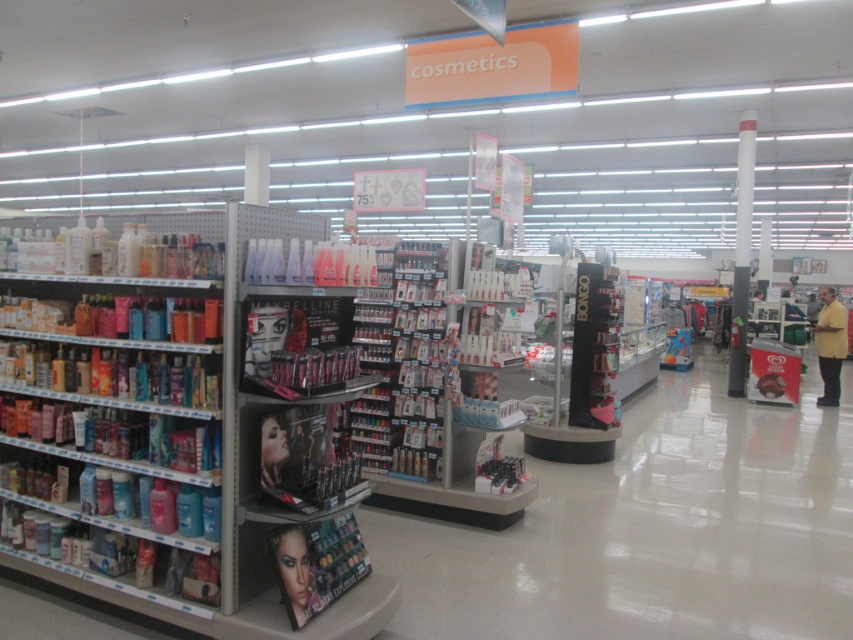
Question: Among these objects, which one is nearest to the camera?

Choices:
 (A) yellow matte shirt at right
 (B) white glossy pillar at center

Answer: (A)

Question: Which point appears closest to the camera in this image?

Choices:
 (A) (819, 336)
 (B) (751, 129)

Answer: (A)

Question: Where is white glossy pillar at center located in relation to yellow matte shirt at right in the image?

Choices:
 (A) right
 (B) left

Answer: (B)

Question: Does white glossy pillar at center have a smaller size compared to yellow matte shirt at right?

Choices:
 (A) no
 (B) yes

Answer: (B)

Question: Where is white glossy pillar at center located in relation to yellow matte shirt at right in the image?

Choices:
 (A) left
 (B) right

Answer: (A)